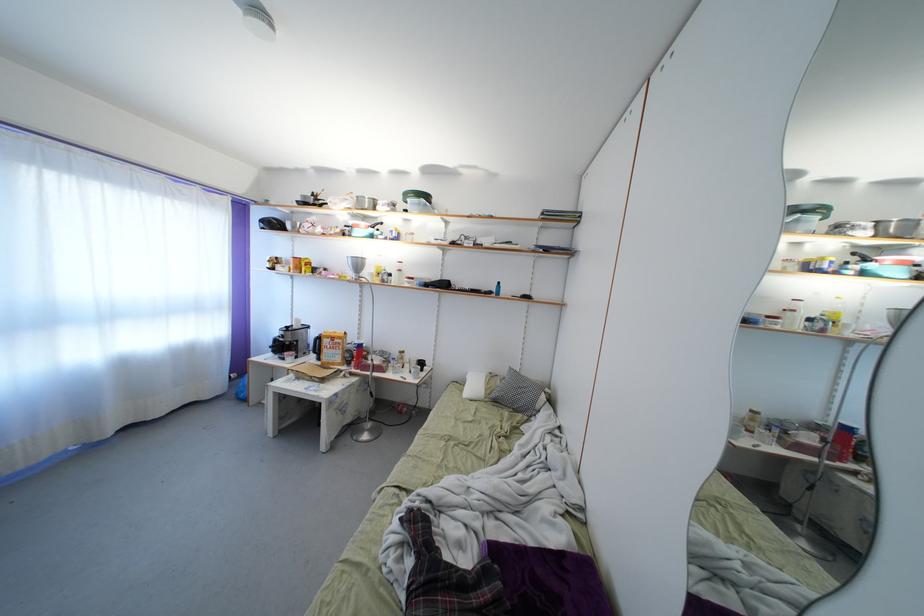
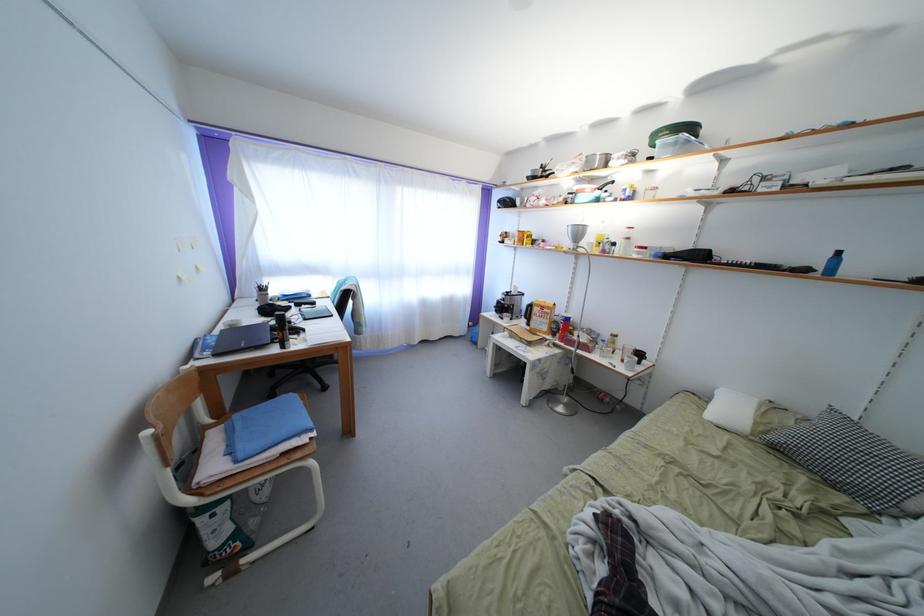
Question: The camera is either moving clockwise (left) or counter-clockwise (right) around the object. The first image is from the beginning of the video and the second image is from the end. Is the camera moving left or right when shooting the video?

Choices:
 (A) Left
 (B) Right

Answer: (B)